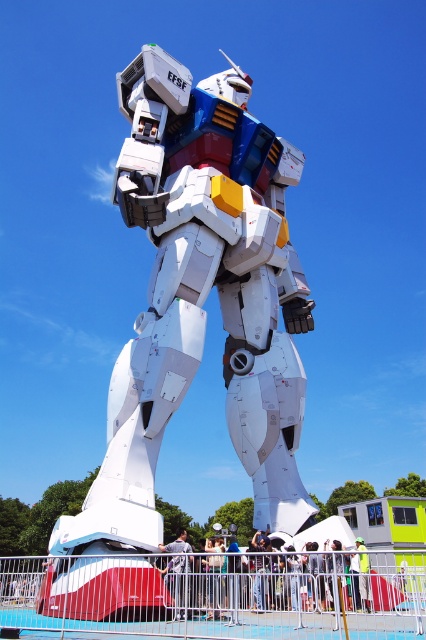
Question: Among these objects, which one is farthest from the camera?

Choices:
 (A) white matte robot at center
 (B) light gray fabric shirt at center
 (C) white plastic robot at center
 (D) metallic red and white amusement park ride at lower left

Answer: (B)

Question: Does white matte robot at center appear over light gray fabric shirt at center?

Choices:
 (A) no
 (B) yes

Answer: (B)

Question: Does white matte robot at center have a larger size compared to light gray fabric shirt at center?

Choices:
 (A) no
 (B) yes

Answer: (B)

Question: Among these objects, which one is farthest from the camera?

Choices:
 (A) light gray fabric pants at center
 (B) white matte robot at center
 (C) white plastic robot at center
 (D) metallic red and white amusement park ride at lower left

Answer: (A)

Question: Considering the relative positions of white plastic robot at center and light gray fabric shirt at center in the image provided, where is white plastic robot at center located with respect to light gray fabric shirt at center?

Choices:
 (A) right
 (B) left

Answer: (A)

Question: Among these objects, which one is farthest from the camera?

Choices:
 (A) metallic red and white amusement park ride at lower left
 (B) light gray fabric shirt at center
 (C) white matte robot at center
 (D) light gray fabric pants at center

Answer: (D)